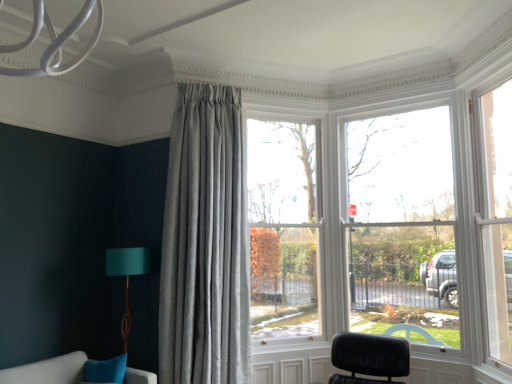
Locate an element on the screen. The image size is (512, 384). teal fabric lampshade at lower left is located at coordinates (127, 277).

The height and width of the screenshot is (384, 512). What do you see at coordinates (205, 242) in the screenshot?
I see `satin grey curtain at center` at bounding box center [205, 242].

Where is `teal fabric lampshade at lower left`? Image resolution: width=512 pixels, height=384 pixels. teal fabric lampshade at lower left is located at coordinates (127, 277).

Considering the sizes of clear glass window at center and teal fabric lampshade at lower left in the image, is clear glass window at center taller or shorter than teal fabric lampshade at lower left?

In the image, clear glass window at center appears to be taller than teal fabric lampshade at lower left.

How different are the orientations of clear glass window at center and teal fabric lampshade at lower left in degrees?

37.2 degrees separate the facing orientations of clear glass window at center and teal fabric lampshade at lower left.

Which is more to the right, clear glass window at center or teal fabric lampshade at lower left?

From the viewer's perspective, clear glass window at center appears more on the right side.

From the image's perspective, does clear glass window at center appear lower than teal fabric lampshade at lower left?

No, from the image's perspective, clear glass window at center is not beneath teal fabric lampshade at lower left.

Can you confirm if teal fabric lampshade at lower left is thinner than clear glass window at center?

No.

Based on the photo, what's the angular difference between teal fabric lampshade at lower left and clear glass window at center's facing directions?

They differ by 37.2 degrees in their facing directions.

In the image, there is a teal fabric lampshade at lower left. What are the coordinates of `window above it (from the image's perspective)` in the screenshot? It's located at (283, 228).

In the image, is teal fabric lampshade at lower left positioned in front of or behind clear glass window at center?

teal fabric lampshade at lower left is in front of clear glass window at center.

Would you say teal fabric lampshade at lower left is to the left or to the right of satin grey curtain at center in the picture?

Clearly, teal fabric lampshade at lower left is on the left of satin grey curtain at center in the image.

Considering the sizes of teal fabric lampshade at lower left and satin grey curtain at center in the image, is teal fabric lampshade at lower left taller or shorter than satin grey curtain at center?

teal fabric lampshade at lower left is shorter than satin grey curtain at center.

Which object is thinner, teal fabric lampshade at lower left or satin grey curtain at center?

teal fabric lampshade at lower left.

Identify the location of curtain below the clear glass window at center (from the image's perspective). Image resolution: width=512 pixels, height=384 pixels. (205, 242).

Is clear glass window at center at the left side of satin grey curtain at center?

In fact, clear glass window at center is to the right of satin grey curtain at center.

What's the angular difference between clear glass window at center and satin grey curtain at center's facing directions?

The angle between the facing direction of clear glass window at center and the facing direction of satin grey curtain at center is 13.3 degrees.

In the scene shown: Is clear glass window at center thinner than satin grey curtain at center?

Yes, clear glass window at center is thinner than satin grey curtain at center.

Considering the positions of objects satin grey curtain at center and clear glass window at center in the image provided, who is in front, satin grey curtain at center or clear glass window at center?

satin grey curtain at center is more forward.

From a real-world perspective, between satin grey curtain at center and clear glass window at center, who is vertically lower?

From a 3D spatial view, satin grey curtain at center is below.

Looking at this image, how many degrees apart are the facing directions of satin grey curtain at center and clear glass window at center?

13.3 degrees.

Is teal fabric lampshade at lower left completely or partially inside satin grey curtain at center?

No, teal fabric lampshade at lower left is not surrounded by satin grey curtain at center.

Which object is wider, satin grey curtain at center or teal fabric lampshade at lower left?

Wider between the two is satin grey curtain at center.

Which of these two, satin grey curtain at center or teal fabric lampshade at lower left, stands taller?

satin grey curtain at center is taller.

You are a GUI agent. You are given a task and a screenshot of the screen. Output one action in this format:
    pyautogui.click(x=<x>, y=<y>)
    Task: Click on the table lamp in front of the clear glass window at center
    This screenshot has width=512, height=384.
    Given the screenshot: What is the action you would take?
    pyautogui.click(x=127, y=277)

Identify the location of window above the teal fabric lampshade at lower left (from the image's perspective). Image resolution: width=512 pixels, height=384 pixels. (283, 228).

Considering their positions, is clear glass window at center positioned closer to satin grey curtain at center than teal fabric lampshade at lower left?

clear glass window at center.

Based on their spatial positions, is teal fabric lampshade at lower left or satin grey curtain at center closer to clear glass window at center?

satin grey curtain at center.

Which object lies further to the anchor point teal fabric lampshade at lower left, satin grey curtain at center or clear glass window at center?

Based on the image, clear glass window at center appears to be further to teal fabric lampshade at lower left.

Estimate the real-world distances between objects in this image. Which object is further from satin grey curtain at center, teal fabric lampshade at lower left or clear glass window at center?

Based on the image, teal fabric lampshade at lower left appears to be further to satin grey curtain at center.

Looking at the image, which one is located further to clear glass window at center, satin grey curtain at center or teal fabric lampshade at lower left?

teal fabric lampshade at lower left is further to clear glass window at center.

Which object lies further to the anchor point teal fabric lampshade at lower left, clear glass window at center or satin grey curtain at center?

Based on the image, clear glass window at center appears to be further to teal fabric lampshade at lower left.

Locate an element on the screen. The image size is (512, 384). curtain between teal fabric lampshade at lower left and clear glass window at center in the horizontal direction is located at coordinates (205, 242).